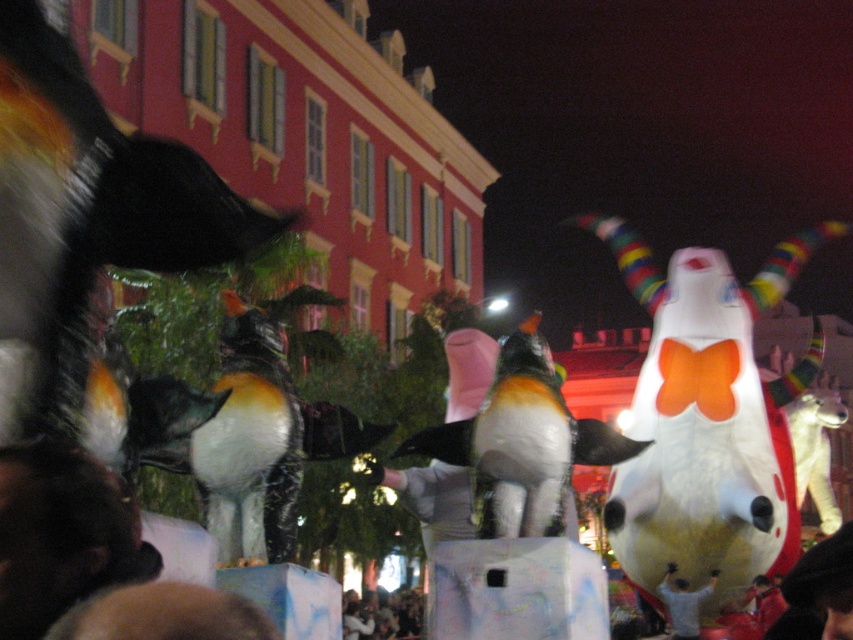
Can you confirm if white glossy horned bull at center is positioned below smooth white shirt at center?

No, white glossy horned bull at center is not below smooth white shirt at center.

Is white glossy horned bull at center above smooth white shirt at center?

Yes.

Who is more distant from viewer, [732,300] or [664,593]?

The point [732,300] is behind.

Where is `white glossy horned bull at center`? white glossy horned bull at center is located at coordinates (706, 419).

What do you see at coordinates (521, 444) in the screenshot?
I see `orange and white plush penguin at center` at bounding box center [521, 444].

Does orange and white plush penguin at center have a greater height compared to dark hair at lower left?

Yes.

I want to click on orange and white plush penguin at center, so click(521, 444).

The image size is (853, 640). I want to click on orange and white plush penguin at center, so tap(521, 444).

Does point (444, 436) come closer to viewer compared to point (676, 618)?

Yes, point (444, 436) is closer to viewer.

At what (x,y) coordinates should I click in order to perform the action: click on orange and white plush penguin at center. Please return your answer as a coordinate pair (x, y). Looking at the image, I should click on [521, 444].